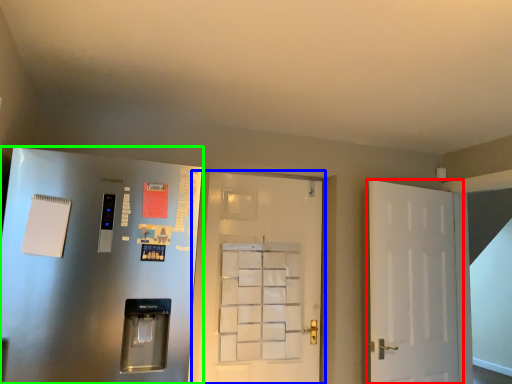
Question: Considering the real-world distances, which object is farthest from door (highlighted by a red box)? door (highlighted by a blue box) or door (highlighted by a green box)?

Choices:
 (A) door
 (B) door

Answer: (B)